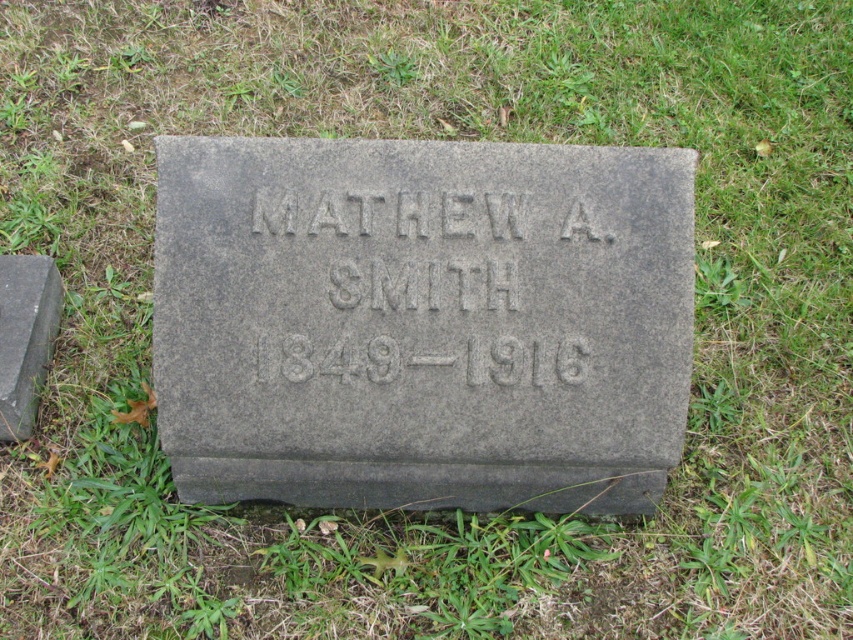
You are standing at the point with coordinates (392, 216). What object are you directly above?

You are directly above the gray stone inscription at center, which is located at point (392, 216).

You are standing in a cemetery and see the gray stone gravestone at center and the gray stone inscription at center. Which object is positioned more to the left?

The gray stone gravestone at center is positioned to the left of the gray stone inscription at center, so it is more to the left.